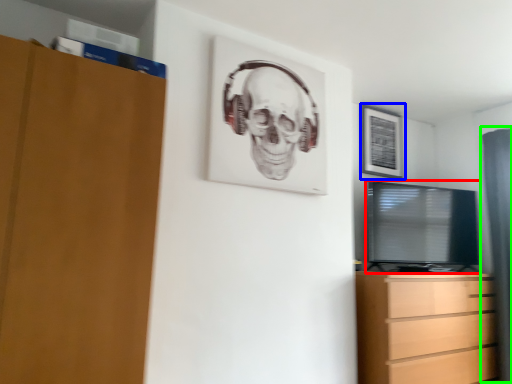
Question: Which object is positioned closest to television (highlighted by a red box)? Select from picture frame (highlighted by a blue box) and curtain (highlighted by a green box).

Choices:
 (A) picture frame
 (B) curtain

Answer: (A)